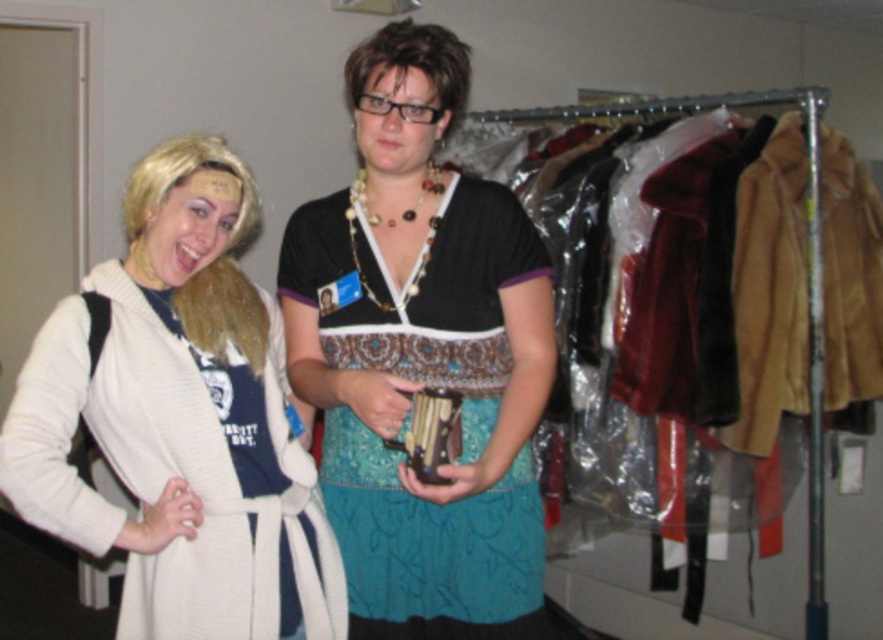
Question: Can you confirm if matte black top at center is bigger than white knit sweater at left?

Choices:
 (A) yes
 (B) no

Answer: (A)

Question: Can you confirm if matte black top at center is thinner than white knit sweater at left?

Choices:
 (A) no
 (B) yes

Answer: (B)

Question: Does matte black top at center have a larger size compared to white knit sweater at left?

Choices:
 (A) yes
 (B) no

Answer: (A)

Question: Which point is closer to the camera taking this photo?

Choices:
 (A) (165, 346)
 (B) (327, 349)

Answer: (A)